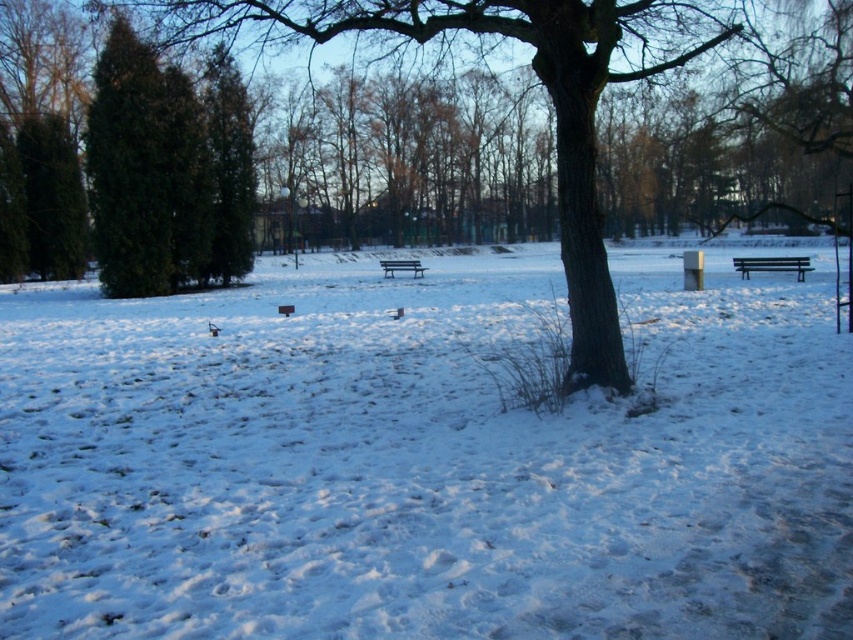
Is white fluffy snow at center above wooden bench at right?

Actually, white fluffy snow at center is below wooden bench at right.

Between white fluffy snow at center and wooden bench at right, which one is positioned higher?

wooden bench at right is higher up.

Between point (216, 605) and point (740, 266), which one is positioned behind?

The point (740, 266) is behind.

Identify the location of white fluffy snow at center. This screenshot has width=853, height=640. (422, 461).

Does brown rough tree trunk at center have a greater width compared to wooden bench at center?

Yes, brown rough tree trunk at center is wider than wooden bench at center.

Is brown rough tree trunk at center to the right of wooden bench at center from the viewer's perspective?

No, brown rough tree trunk at center is not to the right of wooden bench at center.

What do you see at coordinates (538, 80) in the screenshot?
I see `brown rough tree trunk at center` at bounding box center [538, 80].

I want to click on brown rough tree trunk at center, so click(538, 80).

Does wooden bench at right have a lesser height compared to wooden bench at center?

No, wooden bench at right is not shorter than wooden bench at center.

Is point (746, 264) closer to camera compared to point (416, 273)?

That is True.

The width and height of the screenshot is (853, 640). Describe the element at coordinates (772, 264) in the screenshot. I see `wooden bench at right` at that location.

This screenshot has height=640, width=853. Find the location of `wooden bench at right`. wooden bench at right is located at coordinates (772, 264).